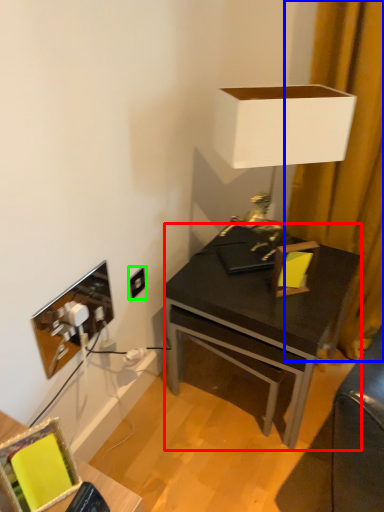
Question: Which object is positioned farthest from desk (highlighted by a red box)? Select from curtain (highlighted by a blue box) and power outlet (highlighted by a green box).

Choices:
 (A) curtain
 (B) power outlet

Answer: (B)